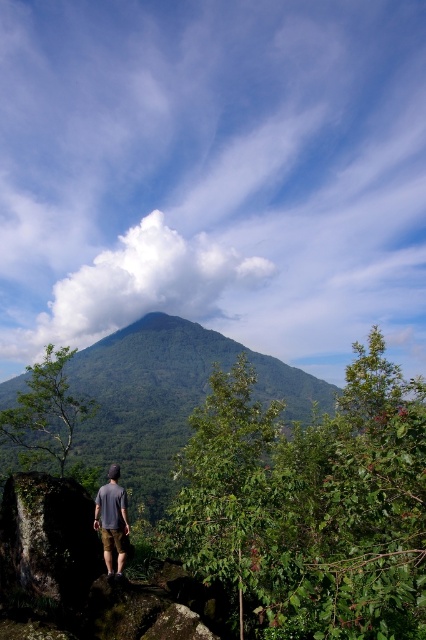
Based on the photo, who is shorter, green leafy mountain at center or gray cotton shirt at center?

Standing shorter between the two is gray cotton shirt at center.

Which is below, green leafy mountain at center or gray cotton shirt at center?

green leafy mountain at center

Does point (152, 396) come farther from viewer compared to point (118, 576)?

Yes.

At what (x,y) coordinates should I click in order to perform the action: click on green leafy mountain at center. Please return your answer as a coordinate pair (x, y). Looking at the image, I should click on (167, 396).